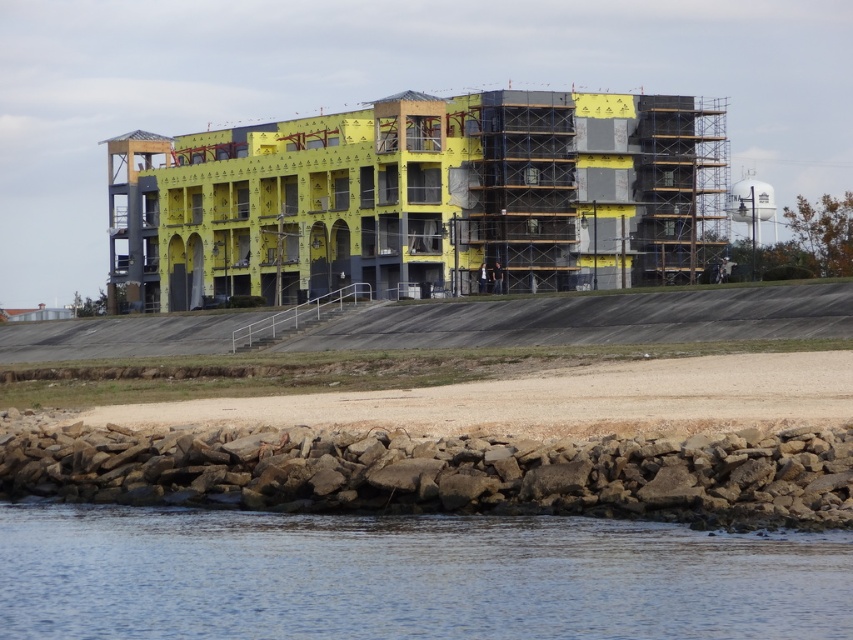
Is yellow foam insulation at center behind clear water at lower center?

Yes, it is behind clear water at lower center.

Between yellow foam insulation at center and clear water at lower center, which one is positioned lower?

clear water at lower center

Which is behind, point (387, 262) or point (347, 540)?

Positioned behind is point (387, 262).

Locate an element on the screen. The image size is (853, 640). yellow foam insulation at center is located at coordinates (422, 198).